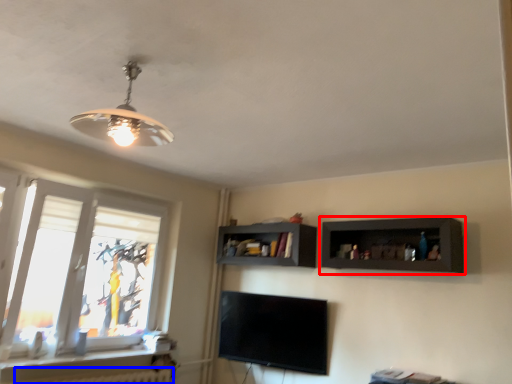
Question: Among these objects, which one is farthest to the camera, shelf (highlighted by a red box) or radiator (highlighted by a blue box)?

Choices:
 (A) shelf
 (B) radiator

Answer: (A)